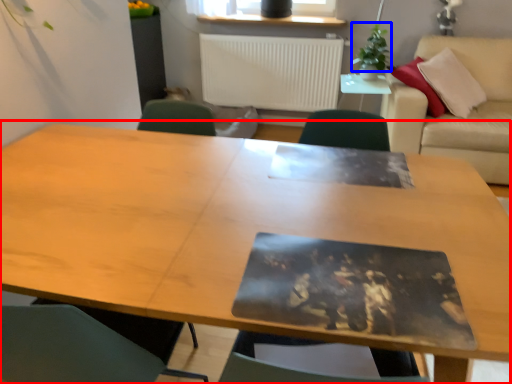
Question: Which of the following is the closest to the observer, table (highlighted by a red box) or plant (highlighted by a blue box)?

Choices:
 (A) table
 (B) plant

Answer: (A)